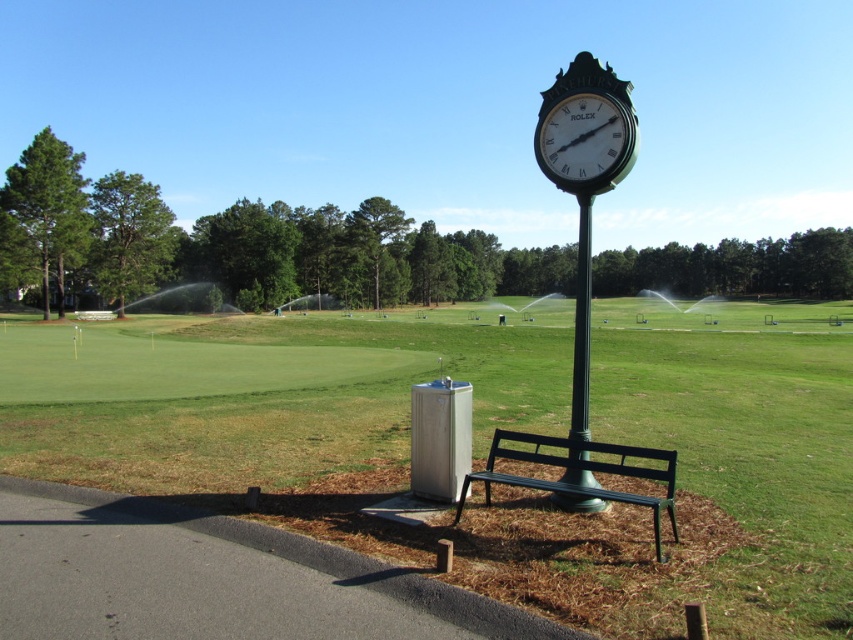
Is green grass at center thinner than green painted metal bench at center?

No.

Between green grass at center and green painted metal bench at center, which one has less height?

green painted metal bench at center is shorter.

Is point (117, 444) positioned behind point (485, 502)?

Yes, it is behind point (485, 502).

Find the location of a particular element. Image resolution: width=853 pixels, height=640 pixels. green grass at center is located at coordinates (483, 445).

Can you confirm if green grass at center is positioned above green polished metal pole at center?

Actually, green grass at center is below green polished metal pole at center.

Does green grass at center have a lesser height compared to green polished metal pole at center?

Yes.

At what (x,y) coordinates should I click in order to perform the action: click on green grass at center. Please return your answer as a coordinate pair (x, y). The image size is (853, 640). Looking at the image, I should click on (483, 445).

Image resolution: width=853 pixels, height=640 pixels. What are the coordinates of `green grass at center` in the screenshot? It's located at (483, 445).

Can you confirm if green painted metal bench at center is smaller than black metal clock at upper right?

Incorrect, green painted metal bench at center is not smaller in size than black metal clock at upper right.

Between green painted metal bench at center and black metal clock at upper right, which one is positioned lower?

Positioned lower is green painted metal bench at center.

This screenshot has width=853, height=640. I want to click on green painted metal bench at center, so click(x=579, y=468).